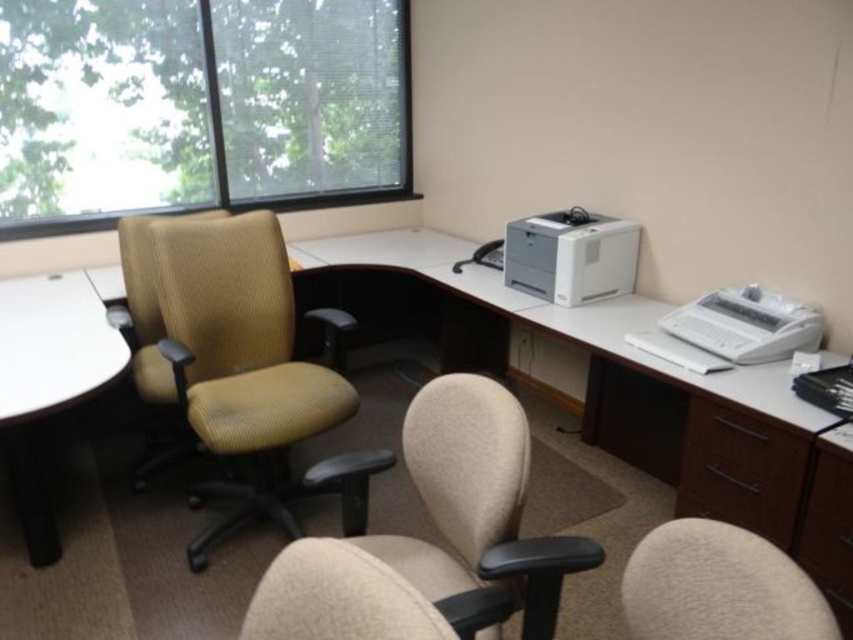
Measure the distance between transparent glass window at upper left and beige fabric office chair at left.

transparent glass window at upper left and beige fabric office chair at left are 3.91 feet apart.

Who is more distant from viewer, (387,61) or (271,225)?

The point (387,61) is behind.

I want to click on transparent glass window at upper left, so click(x=198, y=106).

Between white matte round table at left and white plastic printer at right, which one appears on the right side from the viewer's perspective?

Positioned to the right is white plastic printer at right.

Does white matte round table at left appear under white plastic printer at right?

Indeed, white matte round table at left is positioned under white plastic printer at right.

Is point (41, 376) farther from viewer compared to point (776, 324)?

No, it is not.

This screenshot has width=853, height=640. What are the coordinates of `white matte round table at left` in the screenshot? It's located at (47, 380).

Can you confirm if white matte computer desk at center is positioned to the left of beige fabric swivel chair at lower right?

Indeed, white matte computer desk at center is positioned on the left side of beige fabric swivel chair at lower right.

Is white matte computer desk at center further to the viewer compared to beige fabric swivel chair at lower right?

That is True.

Which is behind, point (453, 364) or point (776, 556)?

The point (453, 364) is more distant.

Locate an element on the screen. The height and width of the screenshot is (640, 853). white matte computer desk at center is located at coordinates (608, 358).